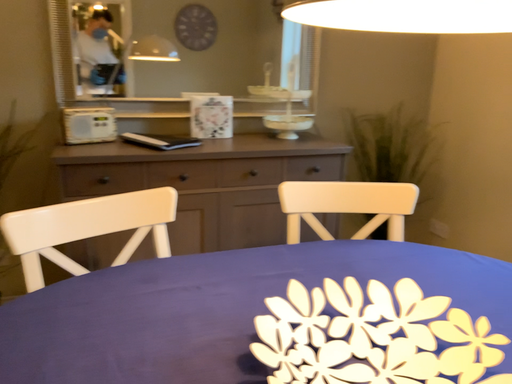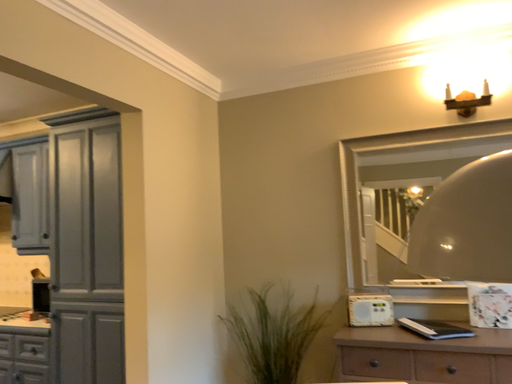
Question: How did the camera likely rotate when shooting the video?

Choices:
 (A) rotated left
 (B) rotated right

Answer: (A)